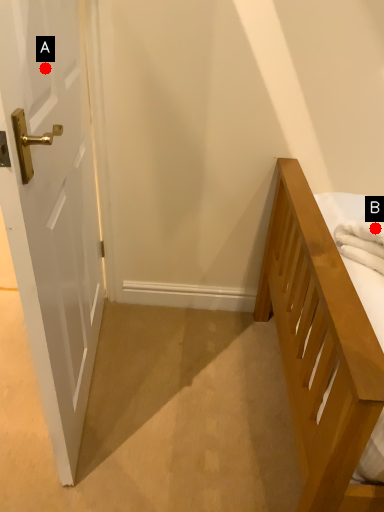
Question: Two points are circled on the image, labeled by A and B beside each circle. Which point is closer to the camera?

Choices:
 (A) A is closer
 (B) B is closer

Answer: (A)